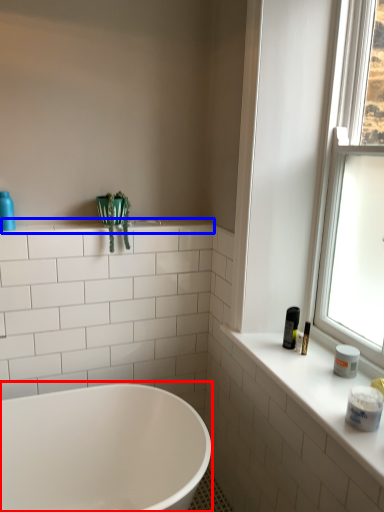
Question: Which point is further to the camera, bathtub (highlighted by a red box) or window sill (highlighted by a blue box)?

Choices:
 (A) bathtub
 (B) window sill

Answer: (B)